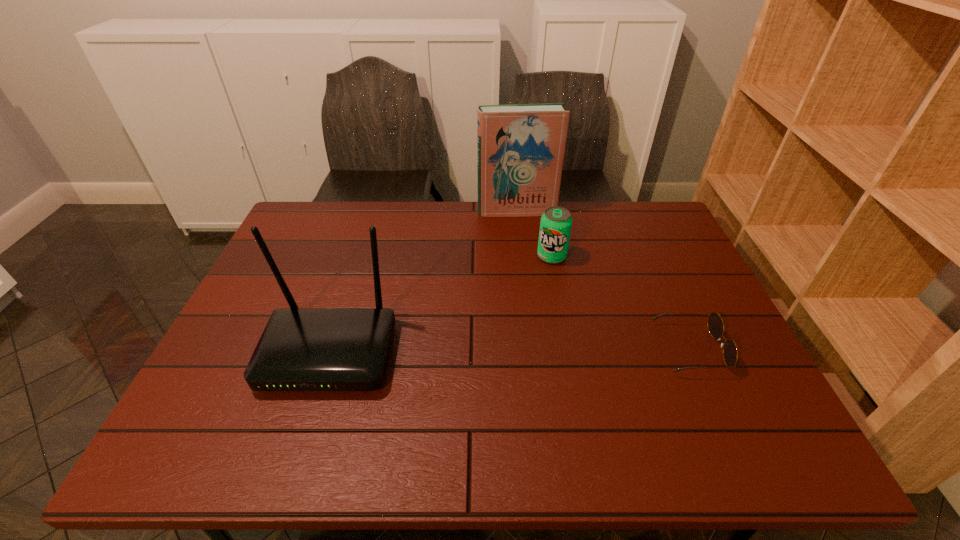
Find the location of a particular element. vacant space at the near edge is located at coordinates (268, 411).

The image size is (960, 540). In the image, there is a desktop. Find the location of `vacant area at the left edge`. vacant area at the left edge is located at coordinates (252, 307).

The height and width of the screenshot is (540, 960). Find the location of `free space at the right edge of the desktop`. free space at the right edge of the desktop is located at coordinates (720, 372).

Find the location of a particular element. This screenshot has height=540, width=960. vacant region at the far left corner is located at coordinates (303, 234).

You are a GUI agent. You are given a task and a screenshot of the screen. Output one action in this format:
    pyautogui.click(x=<x>, y=<y>)
    Task: Click on the free region at the near left corner of the desktop
    The image size is (960, 540).
    Given the screenshot: What is the action you would take?
    pyautogui.click(x=204, y=387)

The width and height of the screenshot is (960, 540). I want to click on vacant space at the far right corner, so click(681, 244).

The height and width of the screenshot is (540, 960). Find the location of `vacant region at the near right corner of the desktop`. vacant region at the near right corner of the desktop is located at coordinates (717, 385).

Where is `vacant region between the rightmost object and the tallest object`? vacant region between the rightmost object and the tallest object is located at coordinates (603, 280).

I want to click on free space between the sunglasses and the hardback book, so pos(603,280).

Where is `free space between the hardback book and the router`? The width and height of the screenshot is (960, 540). free space between the hardback book and the router is located at coordinates (423, 282).